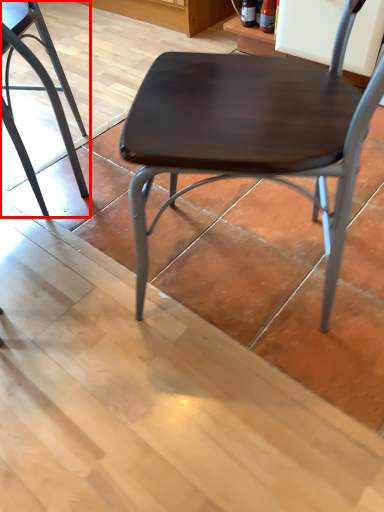
Question: Considering the relative positions of chair (annotated by the red box) and chair in the image provided, where is chair (annotated by the red box) located with respect to the staircase?

Choices:
 (A) right
 (B) left

Answer: (B)